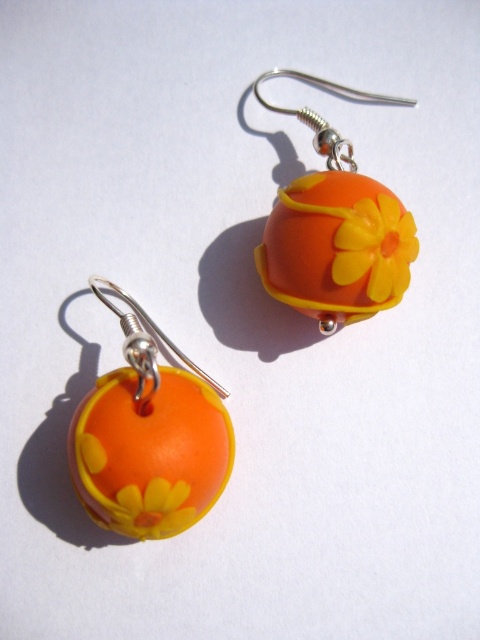
Question: Does orange matte/porcelain flower at center have a greater width compared to silver/metallic hook at lower left?

Choices:
 (A) no
 (B) yes

Answer: (B)

Question: Can you confirm if orange matte/porcelain flower at center is thinner than yellow matte flower at center?

Choices:
 (A) no
 (B) yes

Answer: (A)

Question: Which object appears farthest from the camera in this image?

Choices:
 (A) yellow matte flower at center
 (B) silver/metallic hook at lower left
 (C) orange matte/porcelain flower at center
 (D) matte orange clay flower at lower left

Answer: (B)

Question: From the image, what is the correct spatial relationship of matte orange clay flower at lower left in relation to silver/metallic hook at lower left?

Choices:
 (A) right
 (B) left

Answer: (B)

Question: Among these objects, which one is farthest from the camera?

Choices:
 (A) orange matte/porcelain flower at center
 (B) silver/metallic hook at lower left
 (C) matte orange clay flower at lower left
 (D) yellow matte flower at center

Answer: (B)

Question: Among these objects, which one is nearest to the camera?

Choices:
 (A) silver/metallic hook at lower left
 (B) orange matte/porcelain flower at center

Answer: (B)